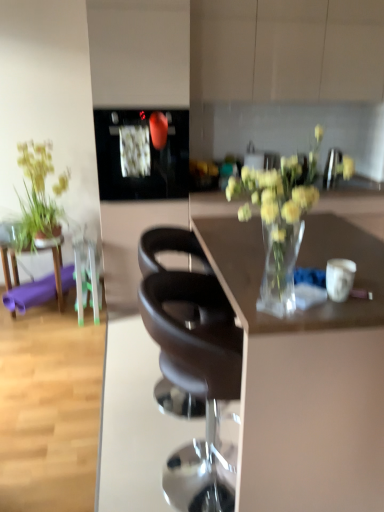
The image size is (384, 512). Find the location of `vacant region to the left of matte black chair at center, marked as the 1th chair in a front-to-back arrangement`. vacant region to the left of matte black chair at center, marked as the 1th chair in a front-to-back arrangement is located at coordinates (94, 459).